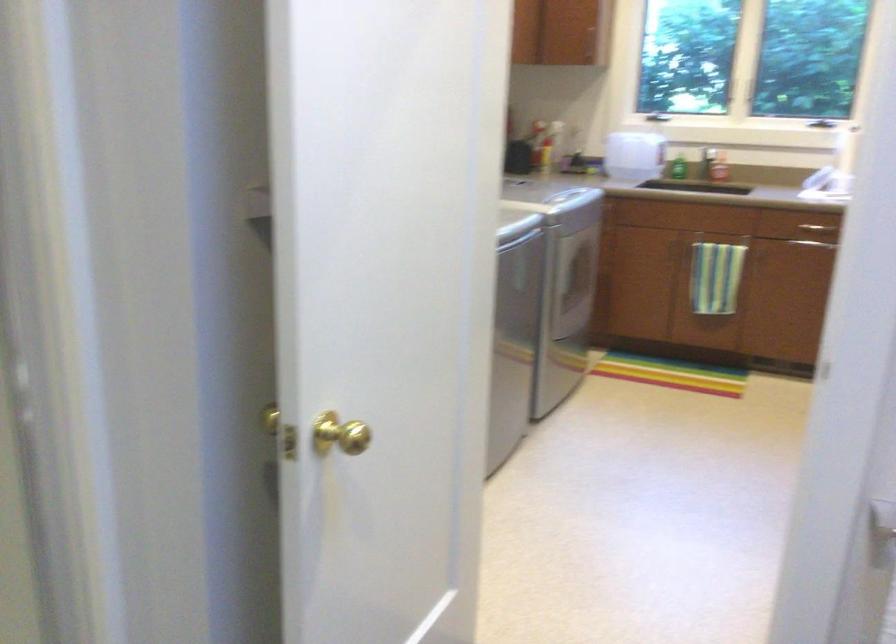
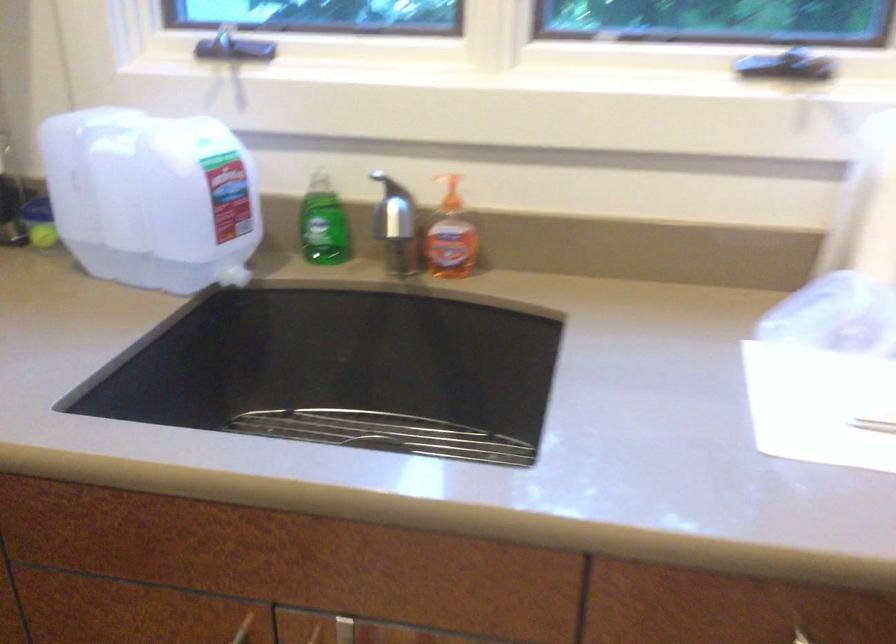
Find the pixel in the second image that matches the point at 639,145 in the first image.

(151, 198)